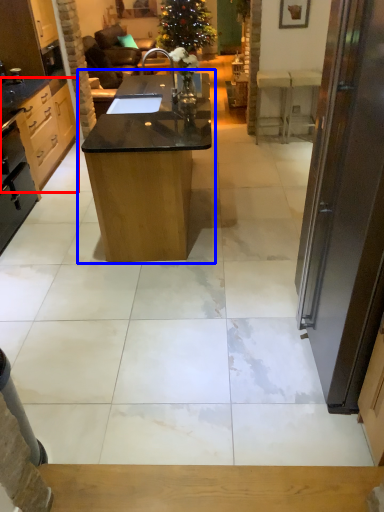
Question: Which object is closer to the camera taking this photo, cabinetry (highlighted by a red box) or table (highlighted by a blue box)?

Choices:
 (A) cabinetry
 (B) table

Answer: (B)